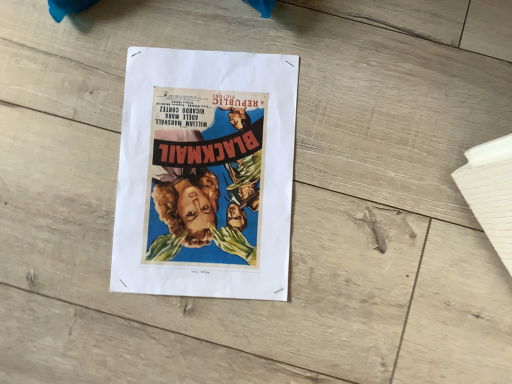
What do you see at coordinates (205, 174) in the screenshot?
I see `colorful paper poster at center` at bounding box center [205, 174].

Where is `colorful paper poster at center`? colorful paper poster at center is located at coordinates (205, 174).

Locate an element on the screen. colorful paper poster at center is located at coordinates (205, 174).